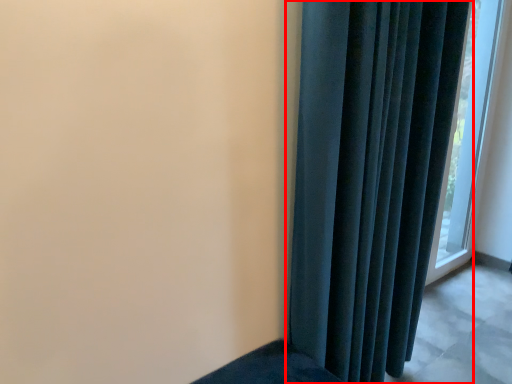
Question: From the image's perspective, where is curtain (annotated by the red box) located in relation to window in the image?

Choices:
 (A) above
 (B) below

Answer: (B)